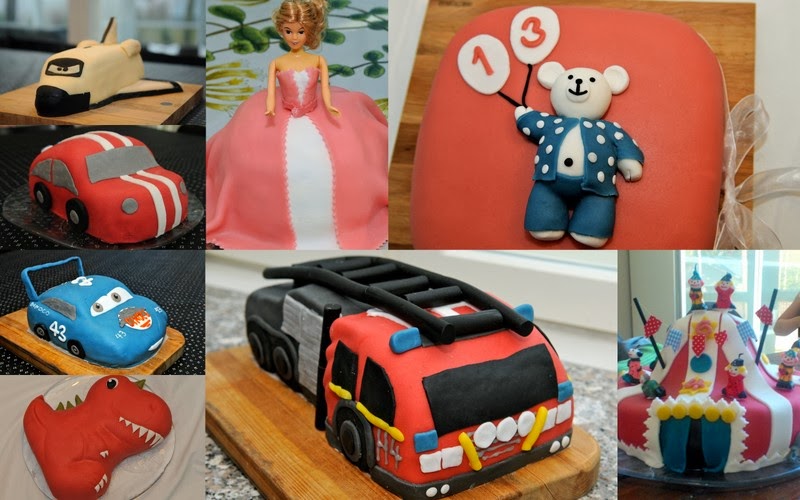
Image resolution: width=800 pixels, height=500 pixels. I want to click on glass plates, so click(745, 479), click(49, 229).